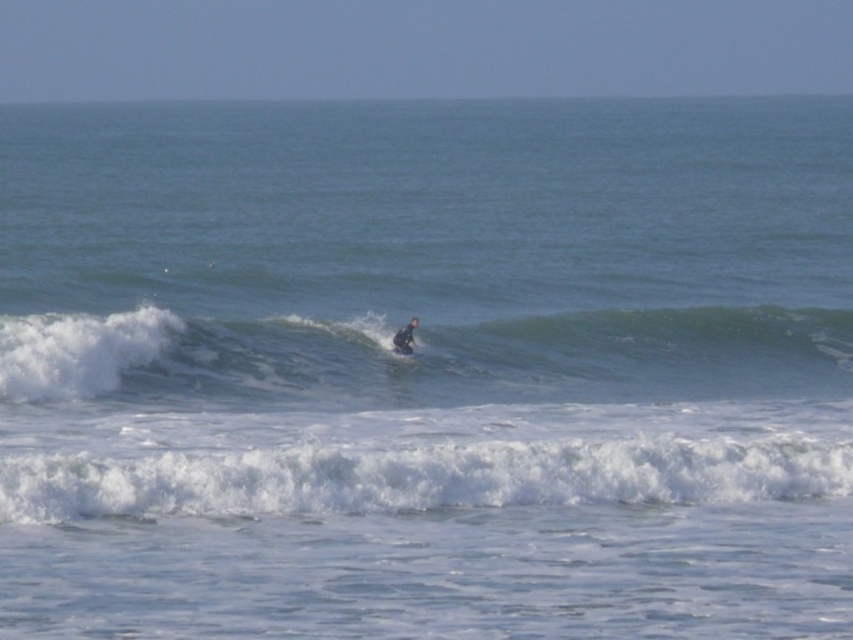
You are a beginner surfer trying to catch a wave. You see the white foamy wave at lower center and the blue wetsuit surfer at center. Which one is bigger in size?

The white foamy wave at lower center is larger in size than the blue wetsuit surfer at center.